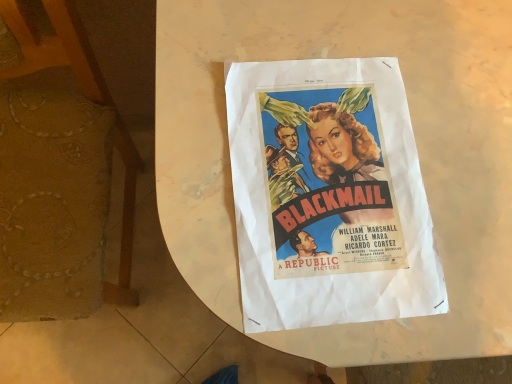
Question: Is wooden at left inside matte paper poster at center?

Choices:
 (A) no
 (B) yes

Answer: (A)

Question: Does matte paper poster at center have a greater width compared to wooden at left?

Choices:
 (A) yes
 (B) no

Answer: (B)

Question: Is the depth of matte paper poster at center less than that of wooden at left?

Choices:
 (A) no
 (B) yes

Answer: (A)

Question: From the image's perspective, is matte paper poster at center above wooden at left?

Choices:
 (A) yes
 (B) no

Answer: (B)

Question: Is matte paper poster at center thinner than wooden at left?

Choices:
 (A) no
 (B) yes

Answer: (B)

Question: Is matte paper poster at center completely or partially outside of wooden at left?

Choices:
 (A) no
 (B) yes

Answer: (B)

Question: Can matte paper poster at center be found inside wooden at left?

Choices:
 (A) yes
 (B) no

Answer: (B)

Question: Can you confirm if wooden at left is wider than matte paper poster at center?

Choices:
 (A) no
 (B) yes

Answer: (B)

Question: Is wooden at left not within matte paper poster at center?

Choices:
 (A) yes
 (B) no

Answer: (A)

Question: Is wooden at left taller than matte paper poster at center?

Choices:
 (A) yes
 (B) no

Answer: (A)

Question: Is wooden at left not near matte paper poster at center?

Choices:
 (A) yes
 (B) no

Answer: (B)

Question: From the image's perspective, is wooden at left below matte paper poster at center?

Choices:
 (A) yes
 (B) no

Answer: (B)

Question: Considering the positions of wooden at left and matte paper poster at center in the image, is wooden at left taller or shorter than matte paper poster at center?

Choices:
 (A) short
 (B) tall

Answer: (B)